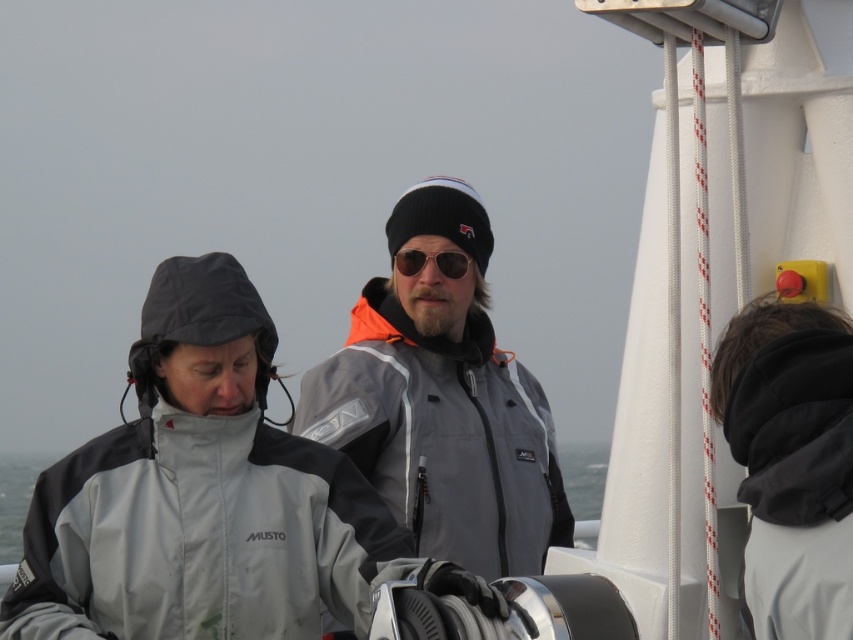
Question: Estimate the real-world distances between objects in this image. Which object is closer to the gray fabric water at center?

Choices:
 (A) black fleece jacket at right
 (B) gray softshell jacket at center
 (C) gray matte jacket at center
 (D) sunglasses at center

Answer: (C)

Question: Considering the relative positions of gray fabric water at center and sunglasses at center in the image provided, where is gray fabric water at center located with respect to sunglasses at center?

Choices:
 (A) right
 (B) left

Answer: (A)

Question: Is gray softshell jacket at center smaller than sunglasses at center?

Choices:
 (A) yes
 (B) no

Answer: (B)

Question: Which point is farther to the camera?

Choices:
 (A) gray matte jacket at center
 (B) gray softshell jacket at center
 (C) gray fabric water at center
 (D) sunglasses at center

Answer: (C)

Question: Which of these objects is positioned farthest from the sunglasses at center?

Choices:
 (A) black fleece jacket at right
 (B) gray fabric water at center
 (C) gray softshell jacket at center

Answer: (B)

Question: Can you confirm if gray matte jacket at center is positioned below sunglasses at center?

Choices:
 (A) no
 (B) yes

Answer: (B)